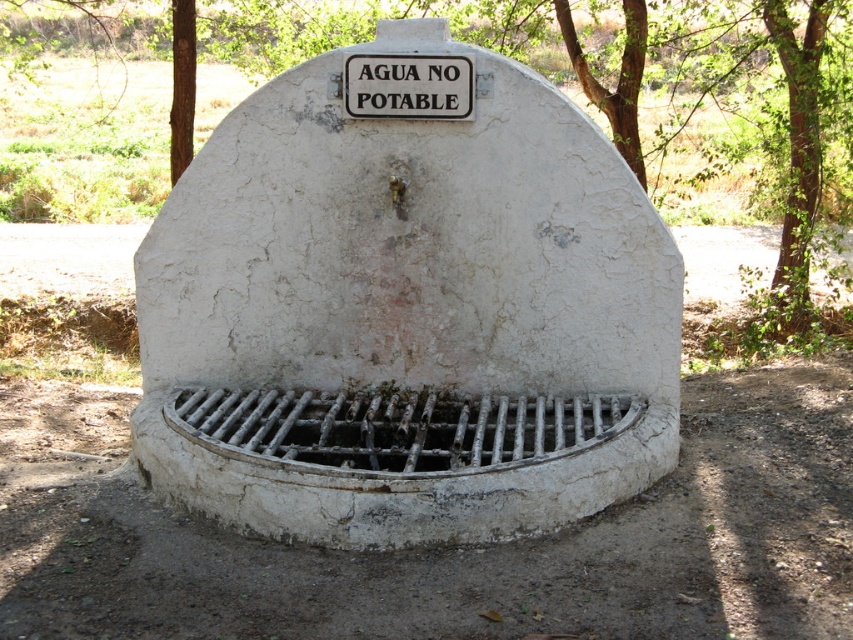
You are a maintenance worker inspecting the fountain. You need to access the rusty metal grate at center for repairs. However, the white plastic sign at upper center is blocking your path. Can you reach the grate without moving the sign?

The rusty metal grate at center is positioned under the white plastic sign at upper center, so you can reach the grate without moving the sign because it is located beneath it.